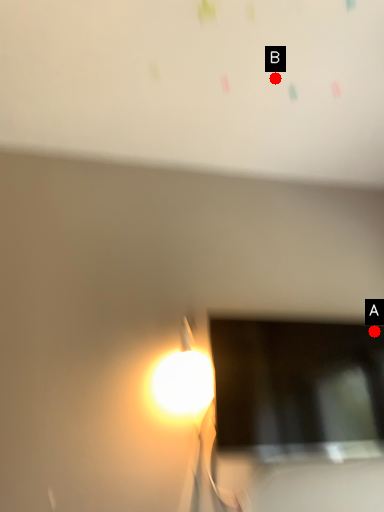
Question: Two points are circled on the image, labeled by A and B beside each circle. Which point is farther from the camera taking this photo?

Choices:
 (A) A is further
 (B) B is further

Answer: (A)